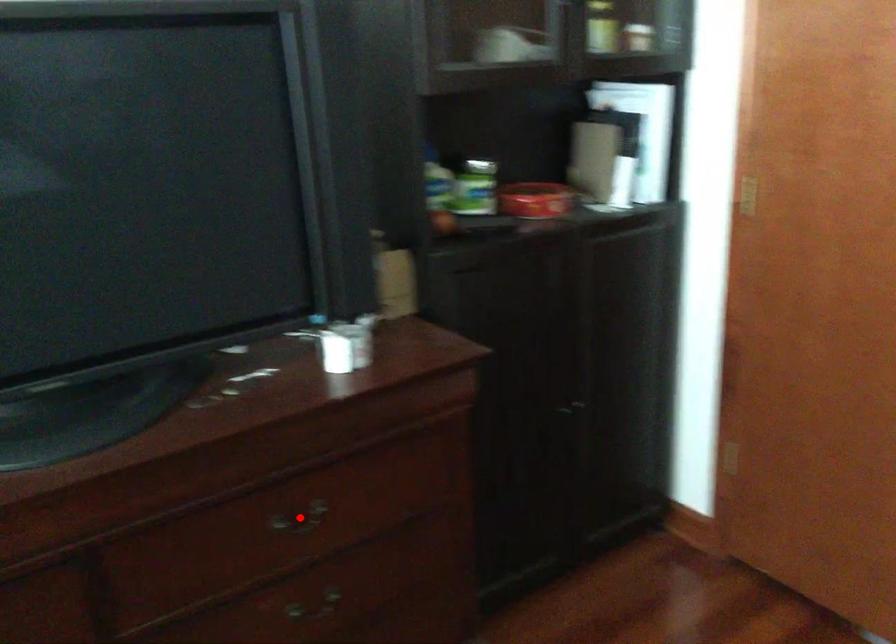
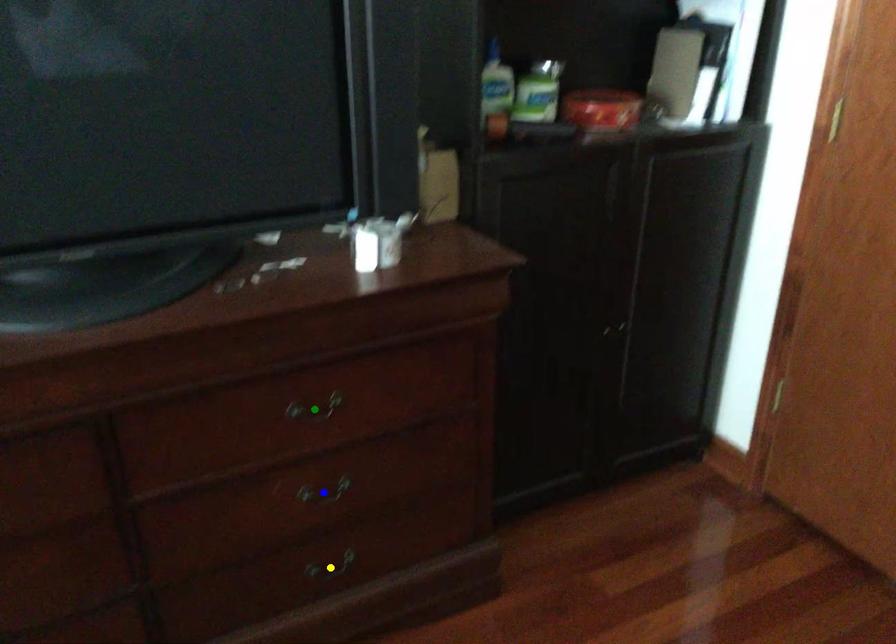
Question: I am providing you with two images of the same scene from different viewpoints. A red point is marked on the first image. You are given multiple points on the second image. In image 2, which mark is for the same physical point as the one in image 1?

Choices:
 (A) blue point
 (B) yellow point
 (C) green point

Answer: (C)